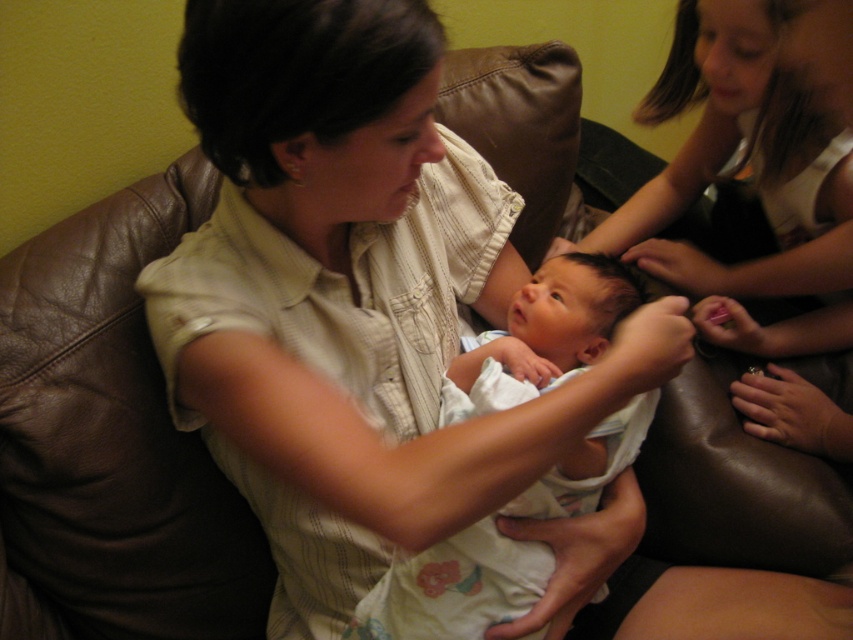
Question: Which point is closer to the camera taking this photo?

Choices:
 (A) (444, 621)
 (B) (206, 97)

Answer: (B)

Question: Which of the following is the closest to the observer?

Choices:
 (A) (662, 326)
 (B) (527, 310)

Answer: (A)

Question: Is white striped shirt at center behind white cotton baby at center?

Choices:
 (A) no
 (B) yes

Answer: (A)

Question: Is white striped shirt at center to the right of white cotton baby at center from the viewer's perspective?

Choices:
 (A) yes
 (B) no

Answer: (B)

Question: Among these points, which one is farthest from the camera?

Choices:
 (A) (415, 413)
 (B) (627, 275)

Answer: (B)

Question: Can you confirm if white striped shirt at center is positioned above white cotton baby at center?

Choices:
 (A) no
 (B) yes

Answer: (B)